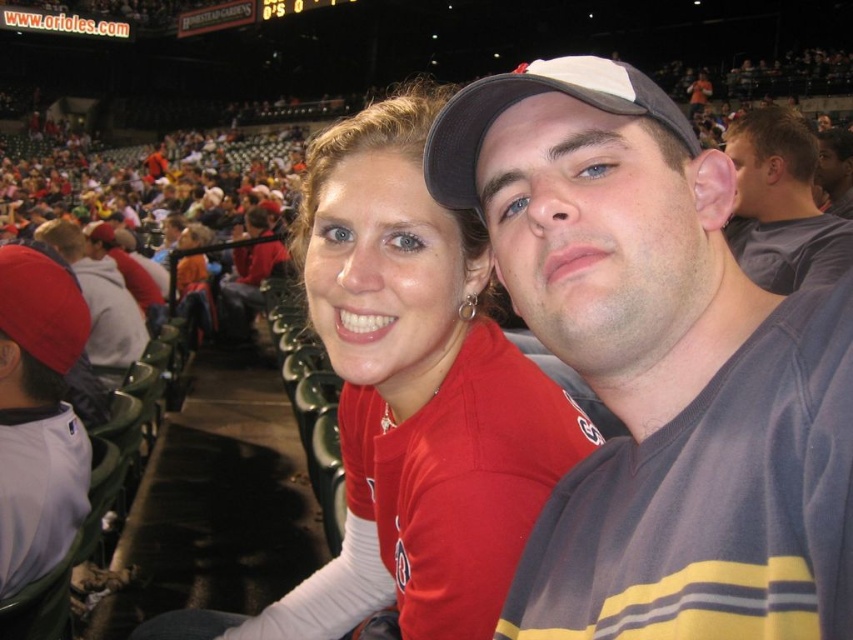
Which is more to the right, matte red jersey at center or matte gray shirt at upper right?

Positioned to the right is matte gray shirt at upper right.

Is point (309, 618) less distant than point (838, 214)?

That is True.

Identify the location of matte red jersey at center. This screenshot has height=640, width=853. (410, 401).

What do you see at coordinates (410, 401) in the screenshot?
I see `matte red jersey at center` at bounding box center [410, 401].

Is matte red jersey at center bigger than white jersey at left?

Yes, matte red jersey at center is bigger than white jersey at left.

Where is `matte red jersey at center`? The image size is (853, 640). matte red jersey at center is located at coordinates (410, 401).

Where is `matte red jersey at center`? This screenshot has height=640, width=853. matte red jersey at center is located at coordinates (410, 401).

Who is taller, matte red jersey at center or gray cotton t-shirt at upper right?

Standing taller between the two is matte red jersey at center.

Describe the element at coordinates (410, 401) in the screenshot. I see `matte red jersey at center` at that location.

At what (x,y) coordinates should I click in order to perform the action: click on matte red jersey at center. Please return your answer as a coordinate pair (x, y). This screenshot has width=853, height=640. Looking at the image, I should click on (410, 401).